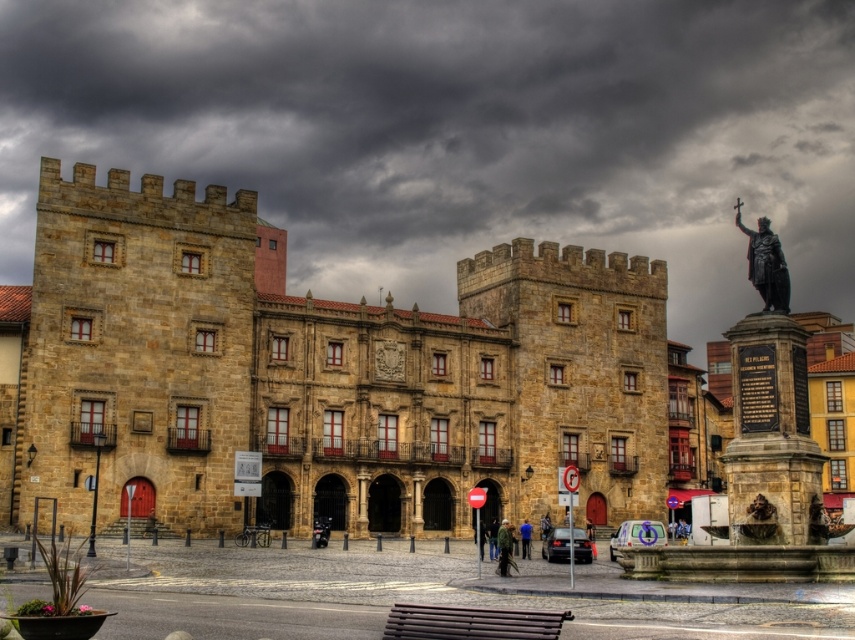
Question: Estimate the real-world distances between objects in this image. Which object is closer to the brown wooden bench at lower center?

Choices:
 (A) polished bronze statue at center right
 (B) blue fabric jacket at center
 (C) green fabric jacket at center

Answer: (C)

Question: Does brown wooden bench at lower center appear over green fabric jacket at center?

Choices:
 (A) yes
 (B) no

Answer: (A)

Question: Which point is farther from the camera taking this photo?

Choices:
 (A) (522, 525)
 (B) (239, 500)

Answer: (A)

Question: Is brown stone castle at center to the right of polished bronze statue at center right from the viewer's perspective?

Choices:
 (A) yes
 (B) no

Answer: (B)

Question: Which of the following is the farthest from the observer?

Choices:
 (A) brown wooden bench at lower center
 (B) polished bronze statue at center right
 (C) blue fabric jacket at center
 (D) brown stone castle at center

Answer: (C)

Question: Is brown wooden bench at lower center wider than green fabric jacket at center?

Choices:
 (A) yes
 (B) no

Answer: (A)